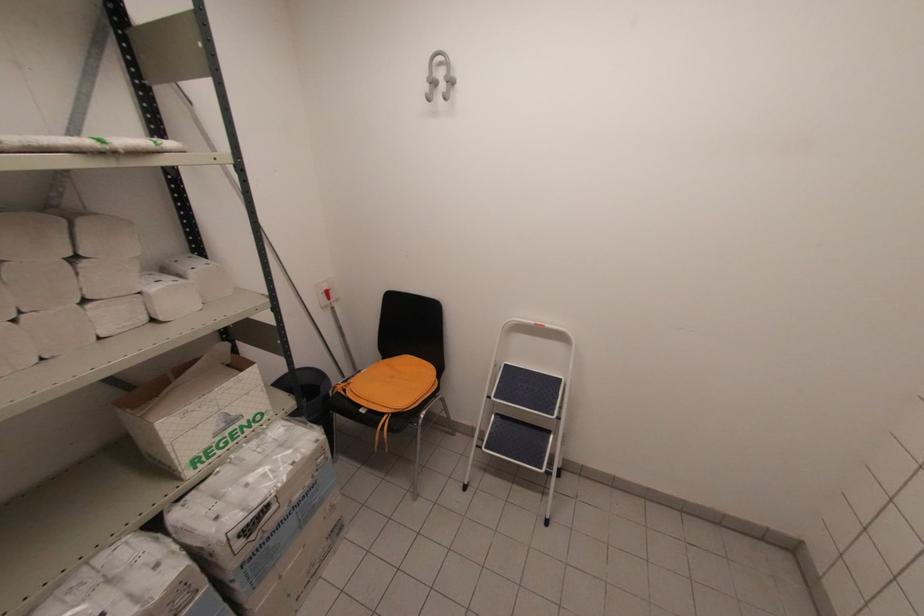
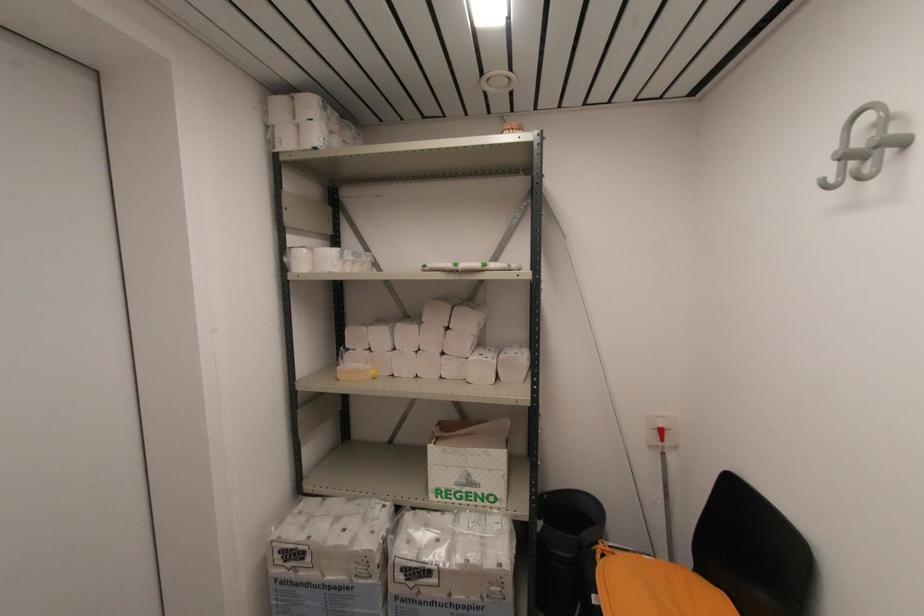
The point at (349, 384) is marked in the first image. Where is the corresponding point in the second image?

(614, 554)